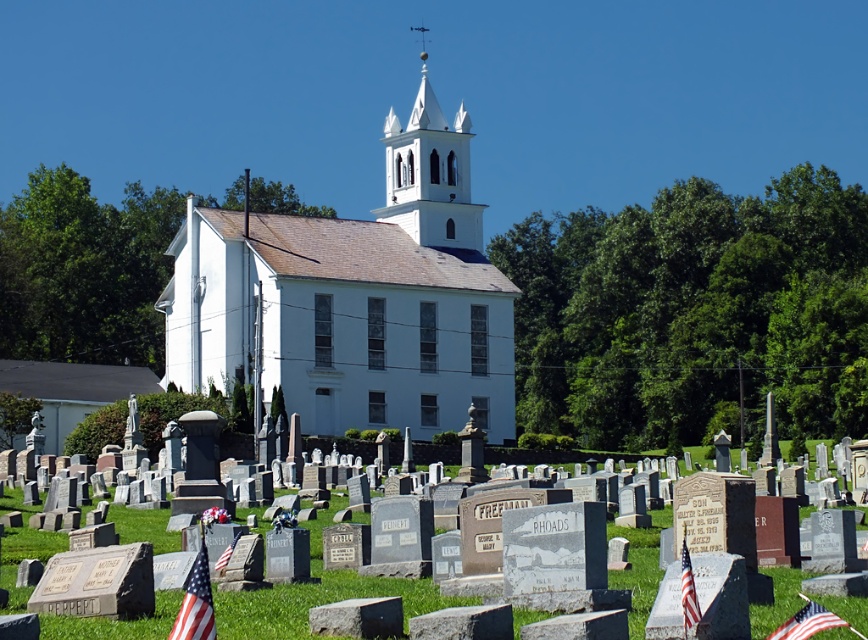
Does american flag at lower right have a smaller size compared to american flag at center?

No, american flag at lower right is not smaller than american flag at center.

Is point (799, 616) positioned behind point (686, 557)?

No, (799, 616) is closer to viewer.

Locate an element on the screen. The image size is (868, 640). american flag at lower right is located at coordinates (806, 621).

Locate an element on the screen. Image resolution: width=868 pixels, height=640 pixels. american flag at lower right is located at coordinates click(806, 621).

Describe the element at coordinates (354, 298) in the screenshot. I see `white smooth church at center` at that location.

Does point (279, 388) lie behind point (689, 595)?

Yes, it is.

Locate an element on the screen. Image resolution: width=868 pixels, height=640 pixels. white smooth church at center is located at coordinates (354, 298).

Locate an element on the screen. white smooth church at center is located at coordinates (354, 298).

Which is above, american flag at lower left or american flag at lower right?

american flag at lower right

Is point (205, 636) farther from viewer compared to point (813, 616)?

No, (205, 636) is closer to viewer.

Is point (181, 611) closer to camera compared to point (799, 625)?

No, it is behind (799, 625).

Locate an element on the screen. This screenshot has height=640, width=868. american flag at lower left is located at coordinates (196, 604).